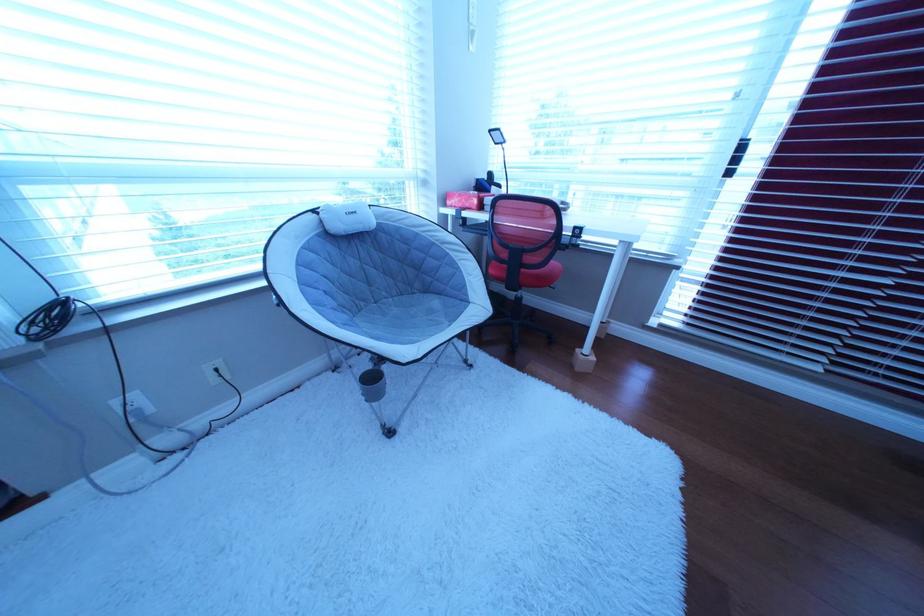
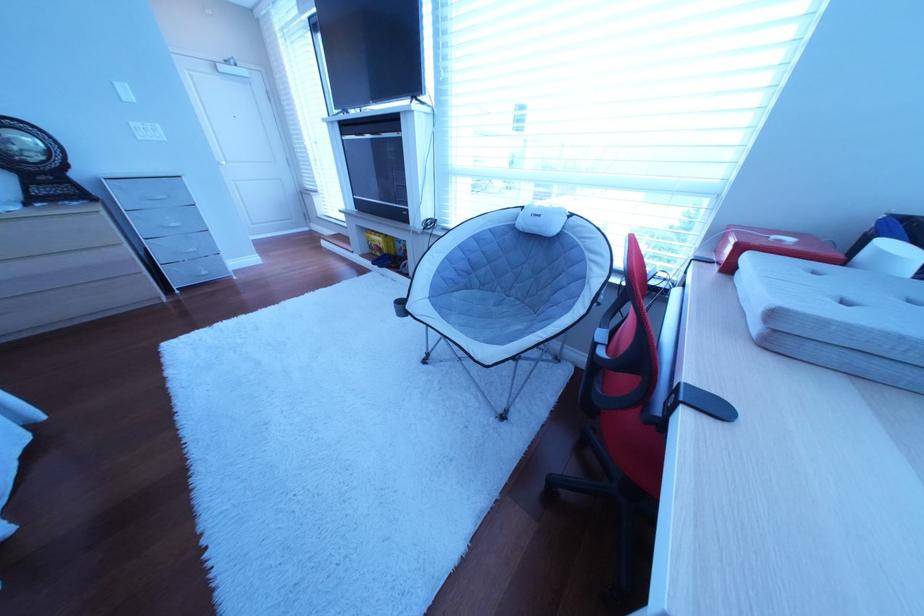
Where in the second image is the point corresponding to point 487,195 from the first image?

(789, 238)